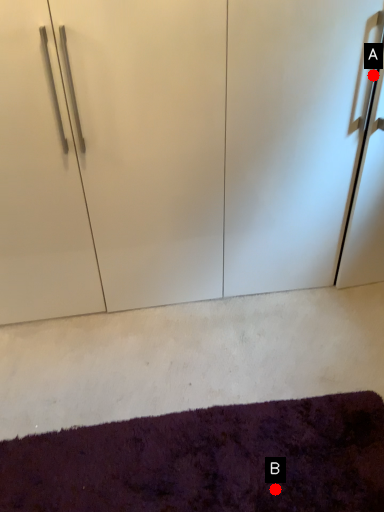
Question: Two points are circled on the image, labeled by A and B beside each circle. Which point is closer to the camera?

Choices:
 (A) A is closer
 (B) B is closer

Answer: (B)